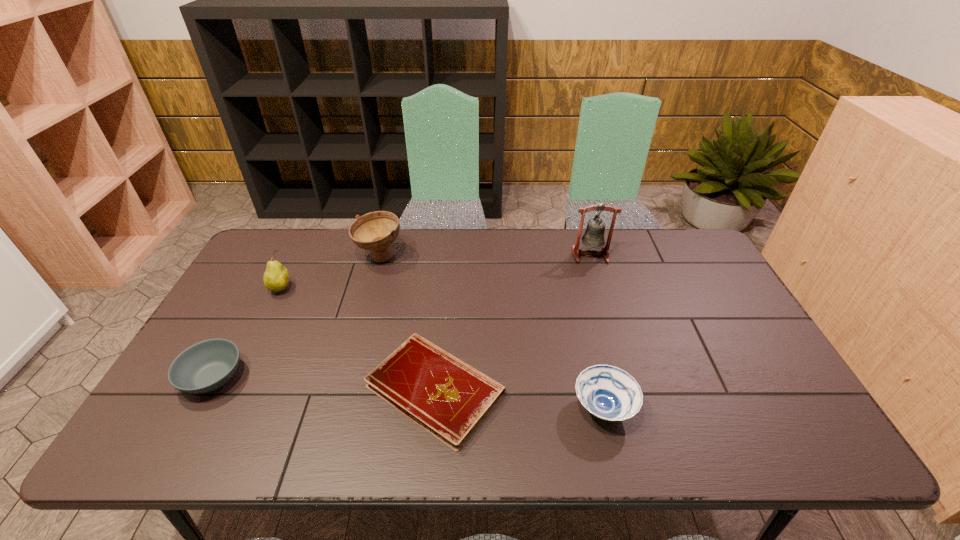
The image size is (960, 540). I want to click on unoccupied position between the bell and the leftmost soup bowl, so click(x=402, y=316).

Where is `vacant space that's between the rightmost soup bowl and the farthest soup bowl`? Image resolution: width=960 pixels, height=540 pixels. vacant space that's between the rightmost soup bowl and the farthest soup bowl is located at coordinates click(492, 333).

Image resolution: width=960 pixels, height=540 pixels. Find the location of `vacant space that's between the bell and the pear`. vacant space that's between the bell and the pear is located at coordinates (436, 272).

Image resolution: width=960 pixels, height=540 pixels. I want to click on empty space that is in between the farthest soup bowl and the tallest object, so click(x=485, y=256).

Locate an element on the screen. free space between the notebook and the leftmost soup bowl is located at coordinates (324, 383).

This screenshot has height=540, width=960. I want to click on vacant area that lies between the tallest object and the farthest soup bowl, so click(x=485, y=256).

I want to click on vacant region between the rightmost soup bowl and the shortest object, so click(x=519, y=399).

Identify the location of object that is the fifth closest to the fourth shortest object. The image size is (960, 540). (594, 235).

I want to click on object that is the fourth nearest to the rightmost soup bowl, so click(206, 366).

This screenshot has height=540, width=960. In order to click on soup bowl that stands as the second closest to the farthest soup bowl in this screenshot , I will do `click(609, 393)`.